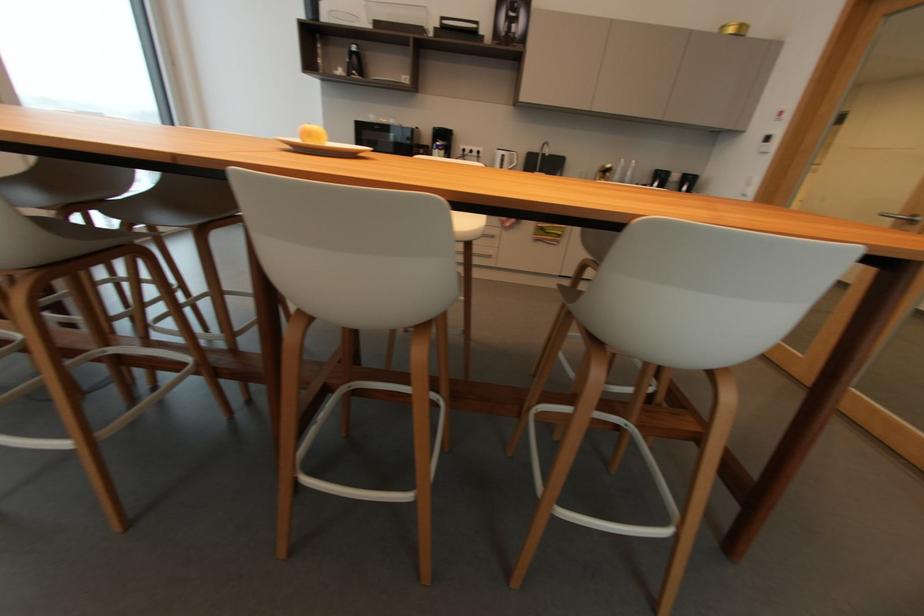
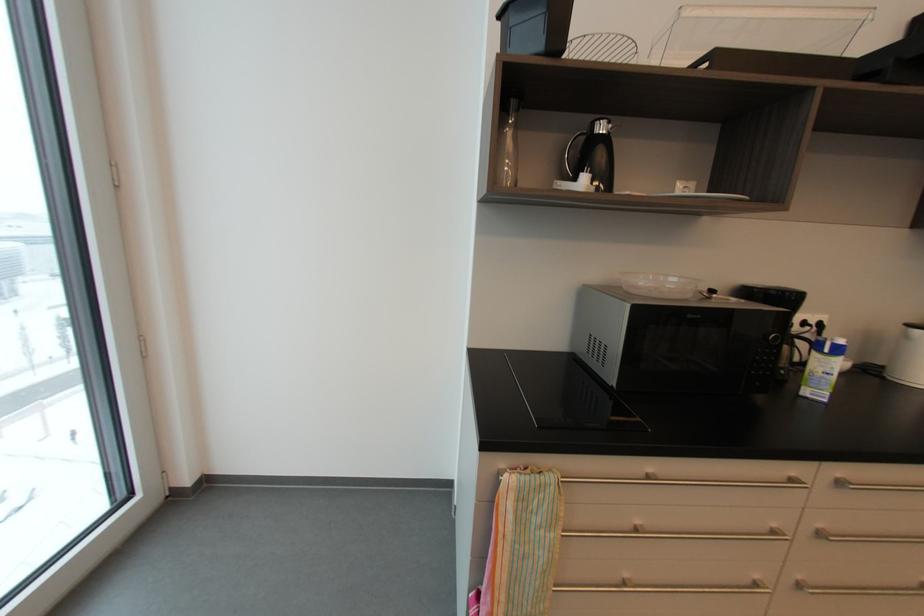
The images are taken continuously from a first-person perspective. In which direction are you moving?

The movement direction of the cameraman is left, forward.